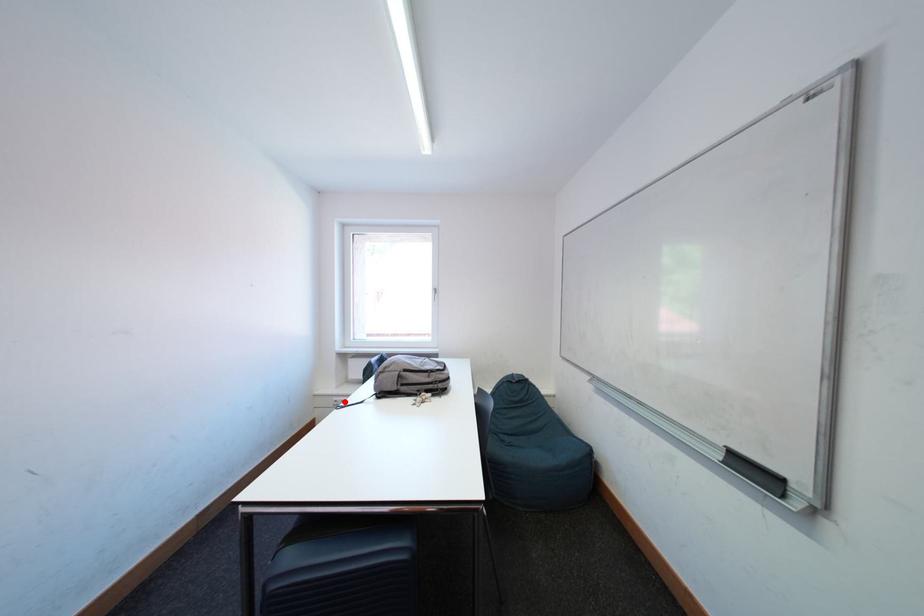
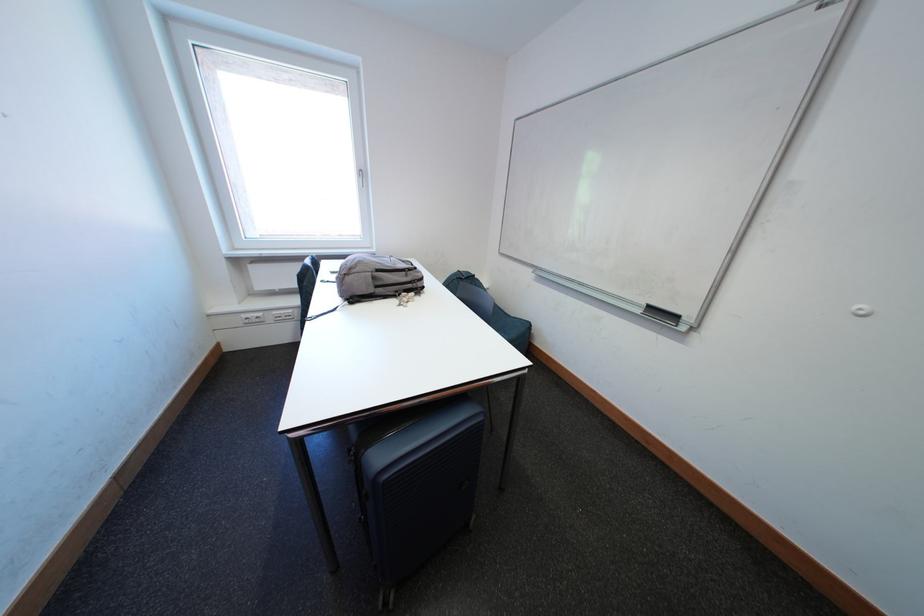
In the second image, find the point that corresponds to the highlighted location in the first image.

(253, 320)